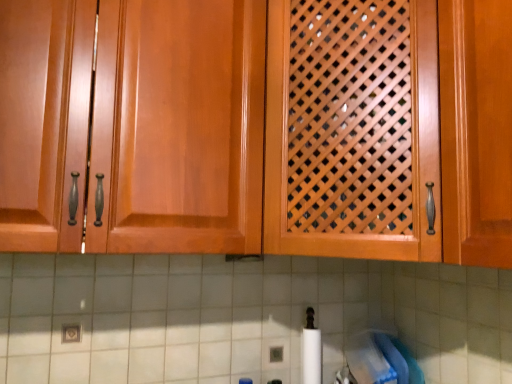
Question: In which direction should I rotate to look at wooden lattice door at center, the first cabinetry positioned from the right?

Choices:
 (A) left
 (B) right

Answer: (B)

Question: From a real-world perspective, is wooden lattice door at center, arranged as the second cabinetry when viewed from the left, located higher than glossy wood cabinet at center, which ranks as the first cabinetry in left-to-right order?

Choices:
 (A) no
 (B) yes

Answer: (B)

Question: Does wooden lattice door at center, arranged as the second cabinetry when viewed from the left, come behind glossy wood cabinet at center, which ranks as the first cabinetry in left-to-right order?

Choices:
 (A) yes
 (B) no

Answer: (A)

Question: Is wooden lattice door at center, the first cabinetry positioned from the right, shorter than glossy wood cabinet at center, which ranks as the first cabinetry in left-to-right order?

Choices:
 (A) yes
 (B) no

Answer: (B)

Question: Does wooden lattice door at center, arranged as the second cabinetry when viewed from the left, come in front of glossy wood cabinet at center, which ranks as the first cabinetry in left-to-right order?

Choices:
 (A) no
 (B) yes

Answer: (A)

Question: From the image's perspective, does wooden lattice door at center, arranged as the second cabinetry when viewed from the left, appear higher than glossy wood cabinet at center, which ranks as the first cabinetry in left-to-right order?

Choices:
 (A) yes
 (B) no

Answer: (A)

Question: Is wooden lattice door at center, arranged as the second cabinetry when viewed from the left, positioned with its back to glossy wood cabinet at center, the second cabinetry viewed from the right?

Choices:
 (A) no
 (B) yes

Answer: (A)

Question: Does white tile at lower center appear on the right side of glossy wood cabinet at center, which ranks as the first cabinetry in left-to-right order?

Choices:
 (A) yes
 (B) no

Answer: (A)

Question: Is white tile at lower center thinner than glossy wood cabinet at center, which ranks as the first cabinetry in left-to-right order?

Choices:
 (A) yes
 (B) no

Answer: (A)

Question: Considering the relative sizes of white tile at lower center and glossy wood cabinet at center, which ranks as the first cabinetry in left-to-right order, in the image provided, is white tile at lower center shorter than glossy wood cabinet at center, which ranks as the first cabinetry in left-to-right order,?

Choices:
 (A) no
 (B) yes

Answer: (B)

Question: Is white tile at lower center smaller than glossy wood cabinet at center, which ranks as the first cabinetry in left-to-right order?

Choices:
 (A) no
 (B) yes

Answer: (B)

Question: Can we say white tile at lower center lies outside glossy wood cabinet at center, the second cabinetry viewed from the right?

Choices:
 (A) yes
 (B) no

Answer: (A)

Question: Is white tile at lower center directly adjacent to glossy wood cabinet at center, the second cabinetry viewed from the right?

Choices:
 (A) yes
 (B) no

Answer: (B)

Question: Is glossy wood cabinet at center, the second cabinetry viewed from the right, far from wooden lattice door at center, the first cabinetry positioned from the right?

Choices:
 (A) no
 (B) yes

Answer: (A)